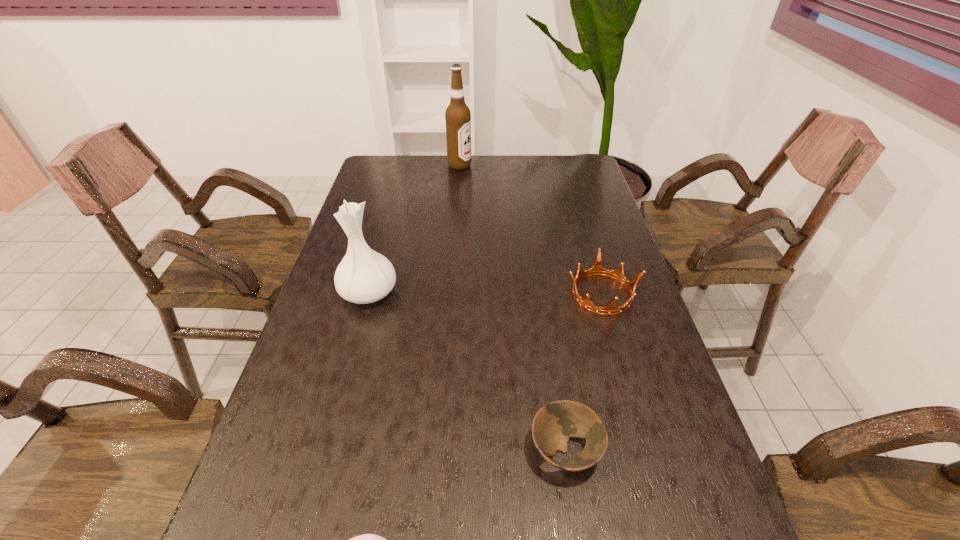
You are a GUI agent. You are given a task and a screenshot of the screen. Output one action in this format:
    pyautogui.click(x=<x>, y=<y>)
    Task: Click on the tallest object
    The width and height of the screenshot is (960, 540).
    Given the screenshot: What is the action you would take?
    pyautogui.click(x=457, y=115)

At what (x,y) coordinates should I click in order to perform the action: click on alcohol. Please return your answer as a coordinate pair (x, y). The image size is (960, 540). Looking at the image, I should click on [x=457, y=115].

Where is `vase`? The height and width of the screenshot is (540, 960). vase is located at coordinates (364, 276).

You are a GUI agent. You are given a task and a screenshot of the screen. Output one action in this format:
    pyautogui.click(x=<x>, y=<y>)
    Task: Click on the crown
    The height and width of the screenshot is (540, 960).
    Given the screenshot: What is the action you would take?
    pyautogui.click(x=597, y=269)

Where is `the fourth farthest object`? the fourth farthest object is located at coordinates (553, 425).

Locate an element on the screen. Image resolution: width=960 pixels, height=540 pixels. vacant position located 0.080m on the label of the farthest object is located at coordinates (492, 166).

Where is `free space located 0.080m on the back of the fourth shortest object`? The width and height of the screenshot is (960, 540). free space located 0.080m on the back of the fourth shortest object is located at coordinates (378, 255).

Where is `blank area located on the front of the crown`? blank area located on the front of the crown is located at coordinates (644, 437).

At what (x,y) coordinates should I click in order to perform the action: click on vacant space located on the left of the bowl. Please return your answer as a coordinate pair (x, y). The image size is (960, 540). Looking at the image, I should click on (459, 450).

You are a GUI agent. You are given a task and a screenshot of the screen. Output one action in this format:
    pyautogui.click(x=<x>, y=<y>)
    Task: Click on the object at the far edge
    
    Given the screenshot: What is the action you would take?
    pyautogui.click(x=457, y=115)